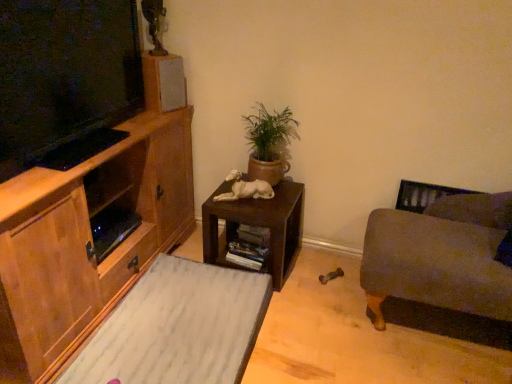
Locate an element on the screen. This screenshot has height=384, width=512. free space in front of dark brown wooden table at center is located at coordinates (298, 316).